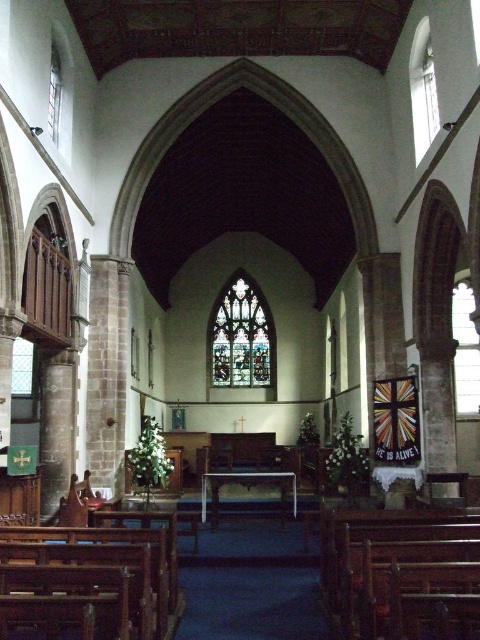
Looking at this image, who is higher up, clear glass window at left or clear glass window at upper center?

clear glass window at upper center is higher up.

What do you see at coordinates (22, 368) in the screenshot? I see `clear glass window at left` at bounding box center [22, 368].

Where is `clear glass window at left`? Image resolution: width=480 pixels, height=640 pixels. clear glass window at left is located at coordinates (22, 368).

Identify the location of clear stained glass window at upper right. This screenshot has width=480, height=640. (465, 349).

Does point (465, 388) lie in front of point (56, 67)?

No, it is behind (56, 67).

Image resolution: width=480 pixels, height=640 pixels. In order to click on clear stained glass window at upper right in this screenshot , I will do `click(465, 349)`.

Who is more distant from viewer, (x=251, y=380) or (x=454, y=310)?

Point (x=251, y=380)

Does point (269, 348) lie behind point (478, 342)?

Yes, it is behind point (478, 342).

Find the location of `stained glass window at center`. stained glass window at center is located at coordinates (240, 337).